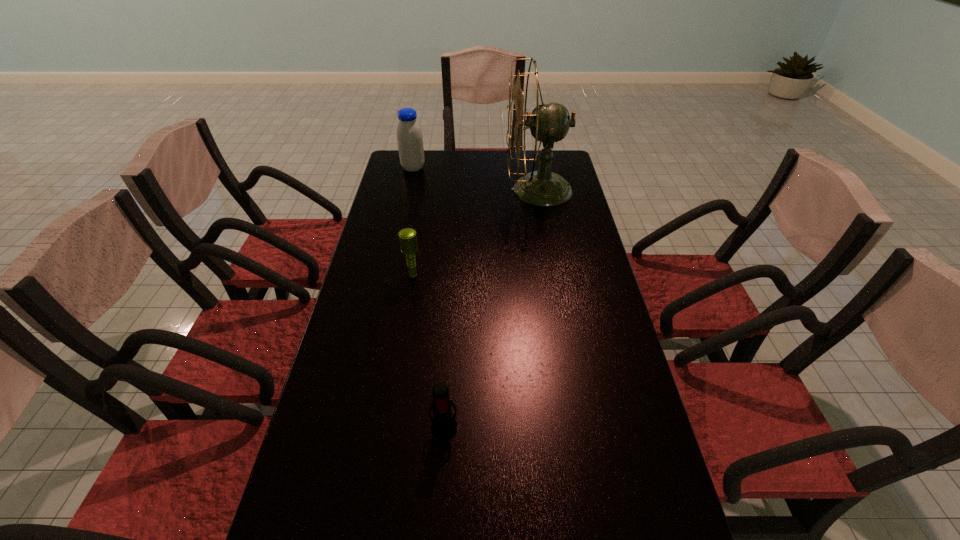
In the image, there is a desktop. Where is `vacant space at the far edge`? Image resolution: width=960 pixels, height=540 pixels. vacant space at the far edge is located at coordinates (486, 177).

In the image, there is a desktop. Where is `vacant space at the left edge`? vacant space at the left edge is located at coordinates (418, 227).

Locate an element on the screen. vacant space at the right edge is located at coordinates (570, 359).

Find the location of `vacant region between the soya milk and the nearer microphone`. vacant region between the soya milk and the nearer microphone is located at coordinates (429, 296).

Locate an element on the screen. The image size is (960, 540). vacant region between the left microphone and the soya milk is located at coordinates (413, 221).

The height and width of the screenshot is (540, 960). I want to click on free space between the farther microphone and the second tallest object, so click(413, 221).

Locate an element on the screen. This screenshot has height=540, width=960. vacant space that's between the rightmost object and the second nearest object is located at coordinates (476, 232).

Locate an element on the screen. This screenshot has height=540, width=960. vacant area that lies between the fan and the left microphone is located at coordinates (476, 232).

Find the location of a particular element. The height and width of the screenshot is (540, 960). free space between the nearest object and the fan is located at coordinates (492, 307).

Identify the location of unoccupied area between the soya milk and the second nearest object. This screenshot has height=540, width=960. [413, 221].